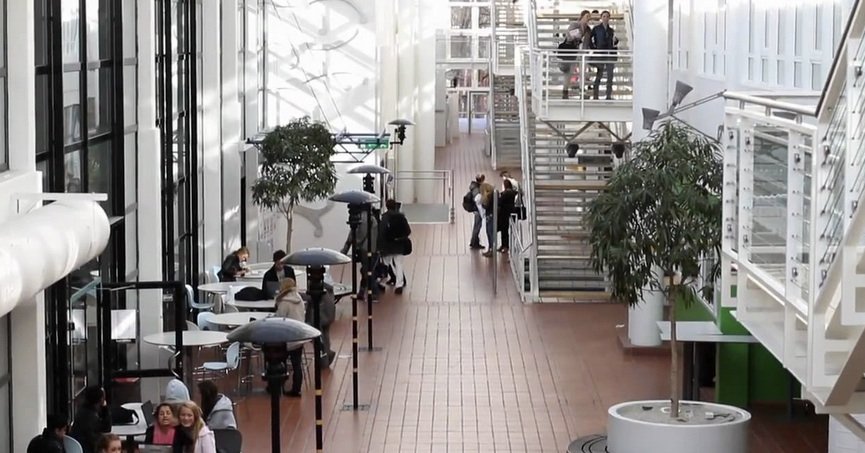
What are the coordinates of `tile flooring` in the screenshot? It's located at (609, 368).